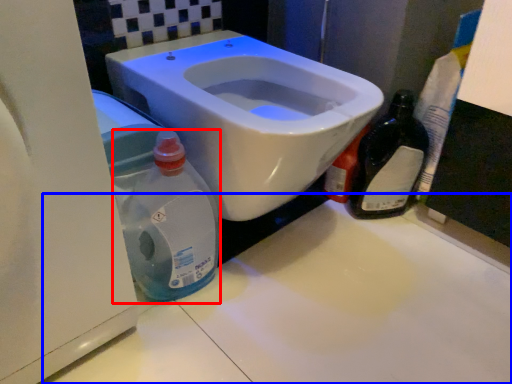
Question: Among these objects, which one is nearest to the camera, cleaning product (highlighted by a red box) or counter top (highlighted by a blue box)?

Choices:
 (A) cleaning product
 (B) counter top

Answer: (B)